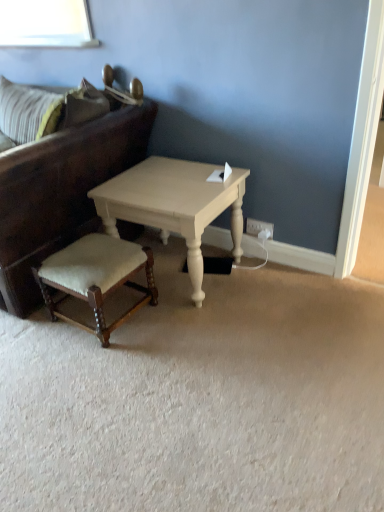
At what (x,y) coordinates should I click in order to perform the action: click on free point to the right of velvet beige stool at lower left. Please return your answer as a coordinate pair (x, y). The height and width of the screenshot is (512, 384). Looking at the image, I should click on (170, 328).